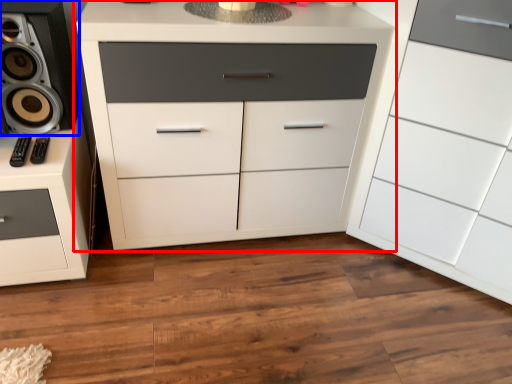
Question: Which object is closer to the camera taking this photo, chest of drawers (highlighted by a red box) or speaker (highlighted by a blue box)?

Choices:
 (A) chest of drawers
 (B) speaker

Answer: (A)